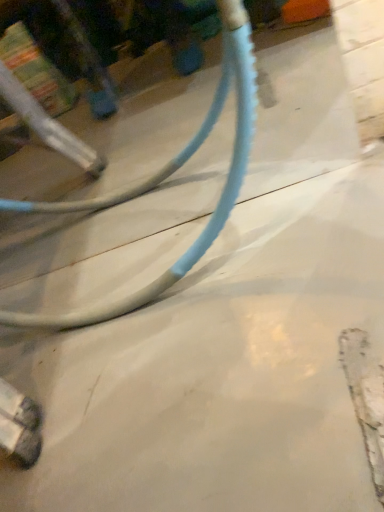
Question: Does smooth concrete at center have a smaller size compared to blue rubber hose at center?

Choices:
 (A) no
 (B) yes

Answer: (B)

Question: Is smooth concrete at center at the left side of blue rubber hose at center?

Choices:
 (A) yes
 (B) no

Answer: (B)

Question: From a real-world perspective, is smooth concrete at center below blue rubber hose at center?

Choices:
 (A) yes
 (B) no

Answer: (A)

Question: Is smooth concrete at center directly adjacent to blue rubber hose at center?

Choices:
 (A) yes
 (B) no

Answer: (B)

Question: Does smooth concrete at center come in front of blue rubber hose at center?

Choices:
 (A) no
 (B) yes

Answer: (A)

Question: From a real-world perspective, is smooth concrete at center on blue rubber hose at center?

Choices:
 (A) no
 (B) yes

Answer: (A)

Question: Is blue rubber hose at center shorter than smooth concrete at center?

Choices:
 (A) no
 (B) yes

Answer: (A)

Question: Is blue rubber hose at center surrounding smooth concrete at center?

Choices:
 (A) yes
 (B) no

Answer: (A)

Question: Does blue rubber hose at center have a greater height compared to smooth concrete at center?

Choices:
 (A) no
 (B) yes

Answer: (B)

Question: Is the depth of blue rubber hose at center greater than that of smooth concrete at center?

Choices:
 (A) no
 (B) yes

Answer: (A)

Question: Does blue rubber hose at center turn towards smooth concrete at center?

Choices:
 (A) yes
 (B) no

Answer: (A)

Question: Would you say blue rubber hose at center is a long distance from smooth concrete at center?

Choices:
 (A) no
 (B) yes

Answer: (A)

Question: Would you say blue rubber hose at center is to the left or to the right of smooth concrete at center in the picture?

Choices:
 (A) right
 (B) left

Answer: (B)